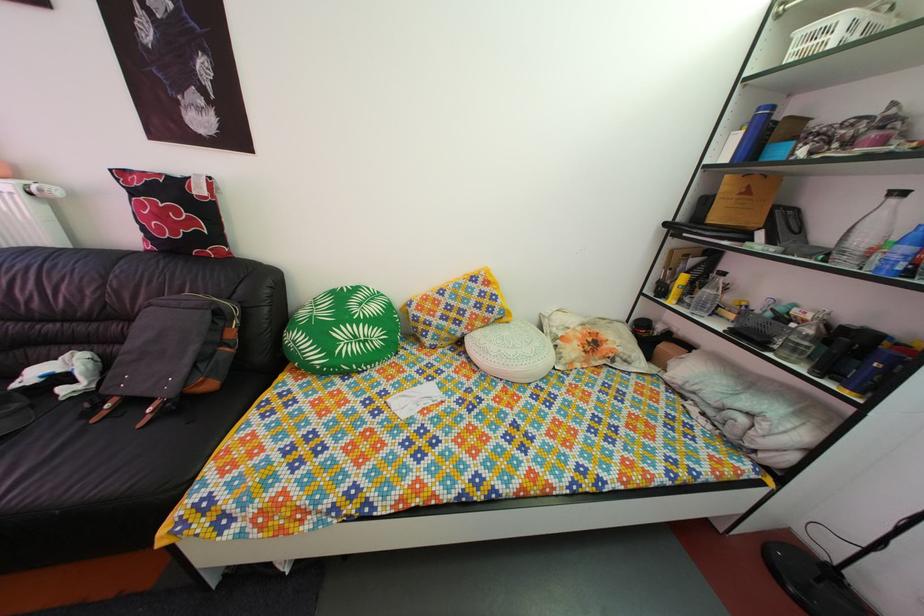
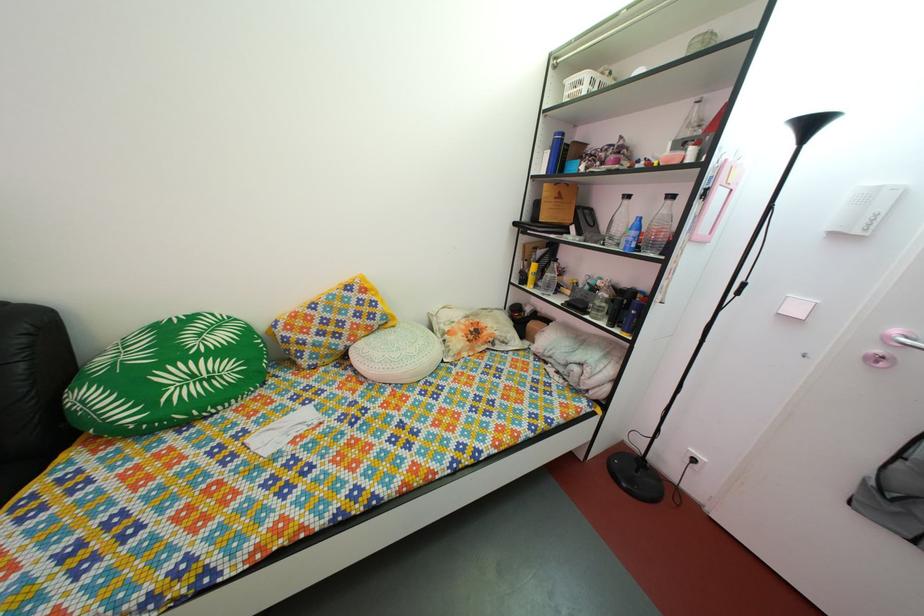
In the second image, find the point that corresponds to point 809,42 in the first image.

(578, 91)